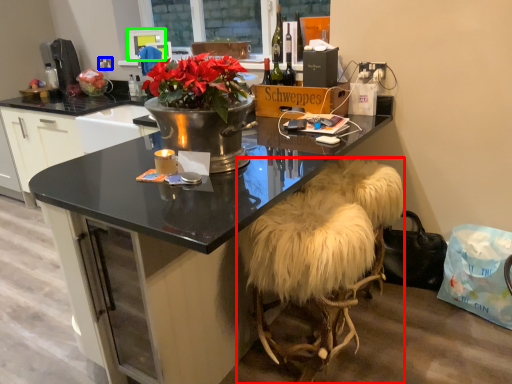
Question: Which is farther away from stool (highlighted by a red box)? power outlet (highlighted by a blue box) or television (highlighted by a green box)?

Choices:
 (A) power outlet
 (B) television

Answer: (A)